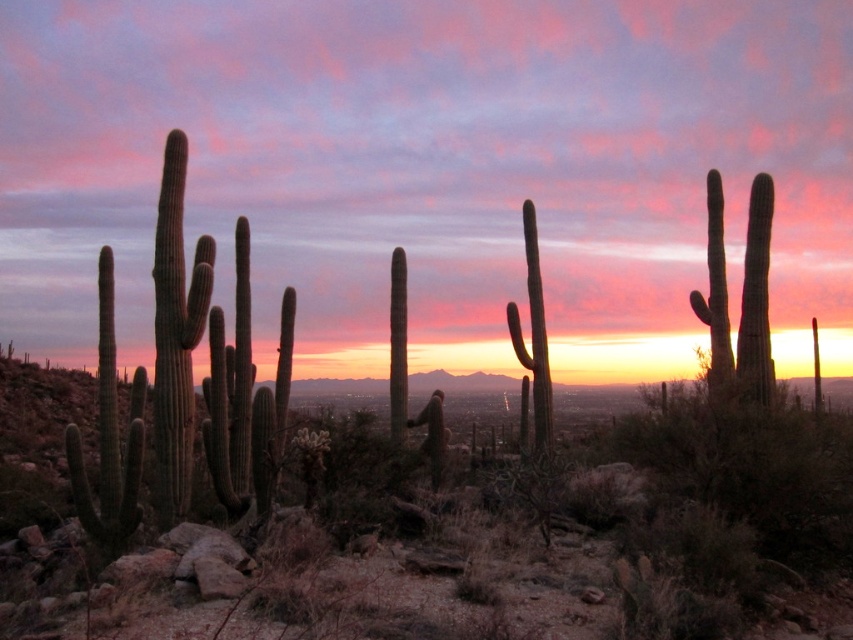
You are a desert explorer trying to navigate between two green spiny cacti. You see the green spiny cactus at left and the green spiny cactus at center. Which cactus is located to the left of the other?

The green spiny cactus at left is positioned on the left side of green spiny cactus at center.